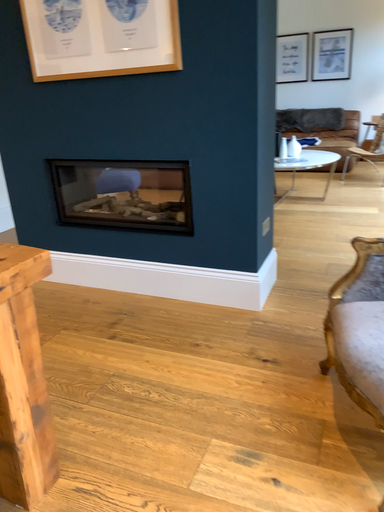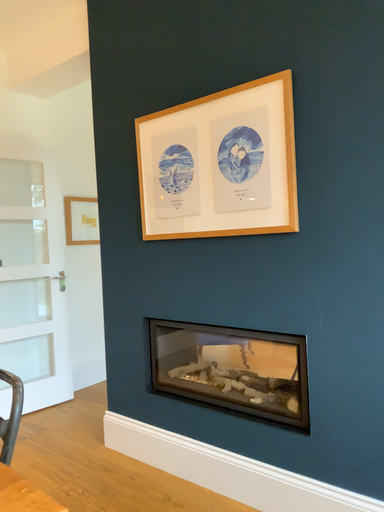
Question: How did the camera likely rotate when shooting the video?

Choices:
 (A) rotated downward
 (B) rotated upward

Answer: (B)